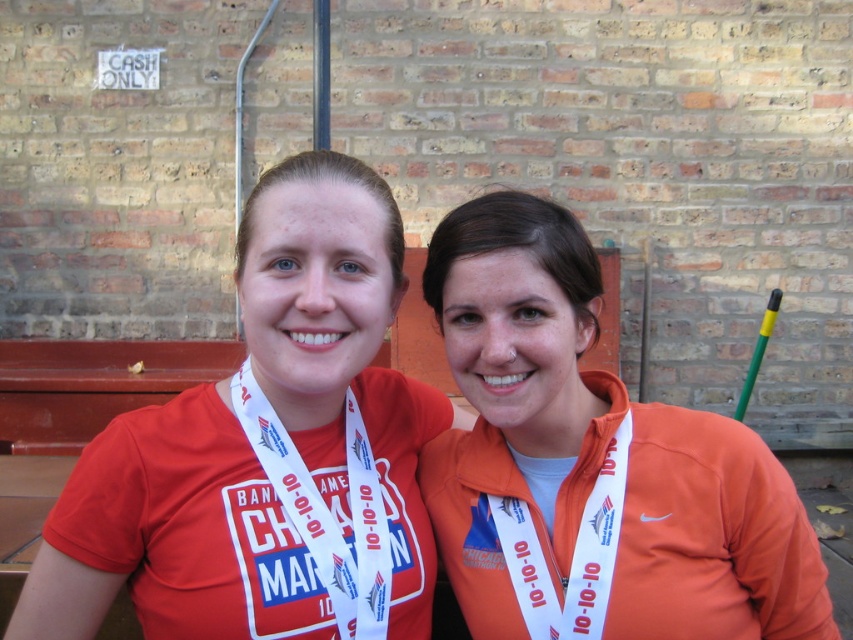
Does point (746, 428) come closer to viewer compared to point (569, 445)?

That is True.

Who is positioned more to the right, orange fleece jacket at center or orange fabric at center?

From the viewer's perspective, orange fleece jacket at center appears more on the right side.

You are a GUI agent. You are given a task and a screenshot of the screen. Output one action in this format:
    pyautogui.click(x=<x>, y=<y>)
    Task: Click on the orange fleece jacket at center
    The image size is (853, 640).
    Given the screenshot: What is the action you would take?
    pyautogui.click(x=595, y=452)

This screenshot has width=853, height=640. In order to click on orange fleece jacket at center in this screenshot , I will do `click(595, 452)`.

Is matte red shirt at center to the right of orange fabric at center from the viewer's perspective?

In fact, matte red shirt at center is to the left of orange fabric at center.

I want to click on matte red shirt at center, so click(264, 454).

Who is positioned more to the right, matte red shirt at center or matte white medal at center?

matte red shirt at center is more to the right.

What do you see at coordinates (264, 454) in the screenshot? I see `matte red shirt at center` at bounding box center [264, 454].

Locate an element on the screen. This screenshot has height=640, width=853. matte red shirt at center is located at coordinates (264, 454).